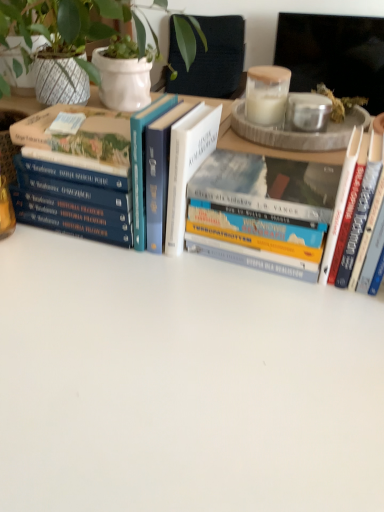
Locate an element on the screen. vacant point above hardcover book at center, which ranks as the second book in right-to-left order (from a real-world perspective) is located at coordinates (268, 167).